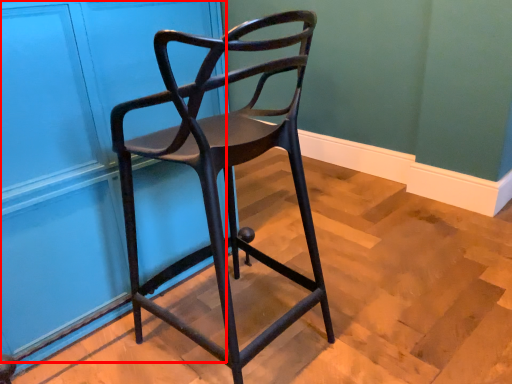
Question: Observing the image, what is the correct spatial positioning of door (annotated by the red box) in reference to chair?

Choices:
 (A) left
 (B) right

Answer: (A)